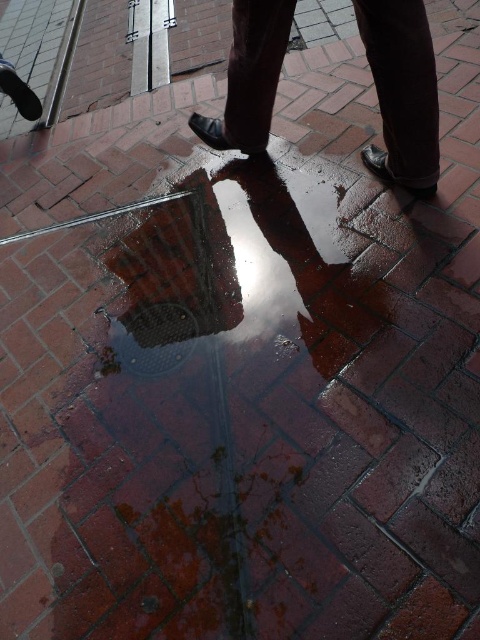
Question: Does metallic grid at center come behind dark brown leather shoes at center?

Choices:
 (A) yes
 (B) no

Answer: (A)

Question: Is metallic grid at center wider than dark brown leather shoes at center?

Choices:
 (A) no
 (B) yes

Answer: (B)

Question: Which object appears closest to the camera in this image?

Choices:
 (A) metallic grid at center
 (B) dark brown leather shoes at center

Answer: (B)

Question: In this image, where is metallic grid at center located relative to dark brown leather shoes at center?

Choices:
 (A) left
 (B) right

Answer: (A)